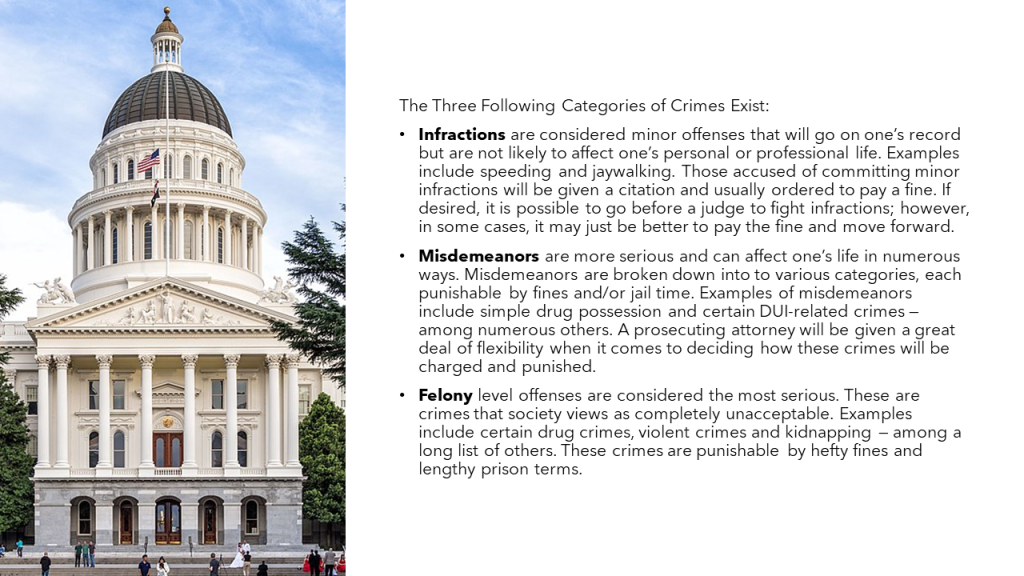
Where is `windows`? Image resolution: width=1024 pixels, height=576 pixels. windows is located at coordinates pos(214,397), pos(240,389), pos(115,400), pos(91,389).